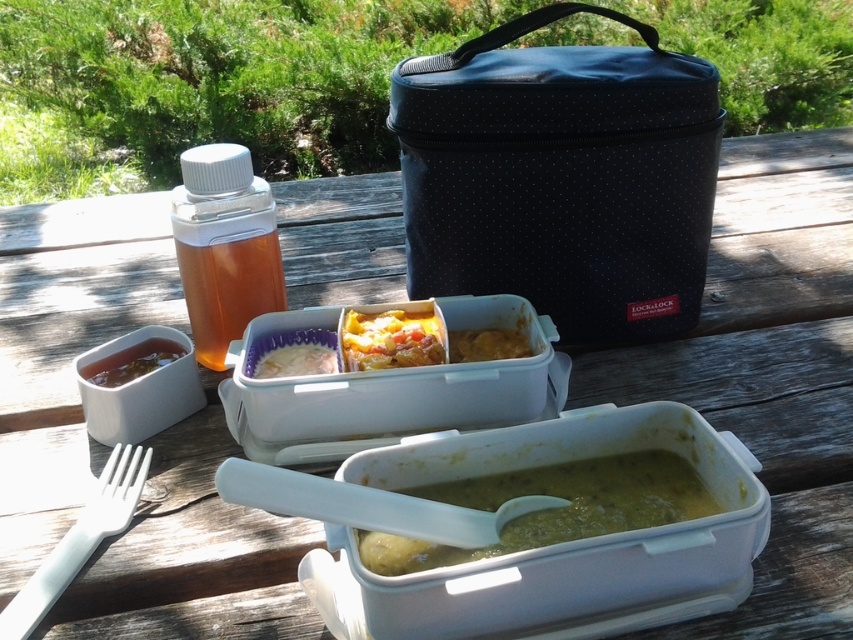
You are setting up a picnic and notice the translucent plastic bottle at upper left and the white creamy rice at center on the table. Which item is placed higher relative to the other?

The translucent plastic bottle at upper left is positioned over the white creamy rice at center, so it is higher.